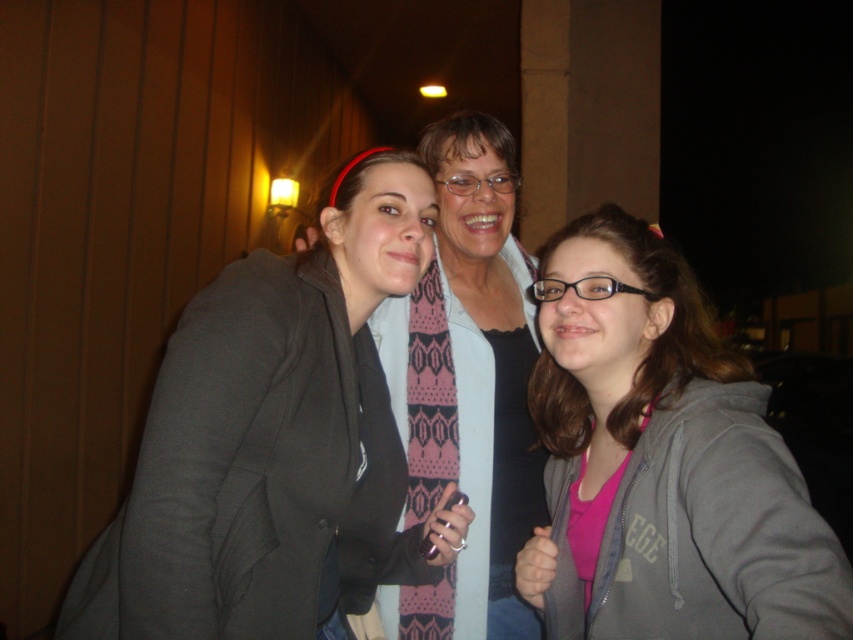
Can you confirm if matte gray hoodie at center is positioned above pink matte hoodie at center?

Indeed, matte gray hoodie at center is positioned over pink matte hoodie at center.

Is point (196, 593) positioned before point (840, 620)?

No.

Between point (402, 188) and point (764, 605), which one is positioned in front?

Point (764, 605) is in front.

Where is `matte gray hoodie at center`? matte gray hoodie at center is located at coordinates (276, 442).